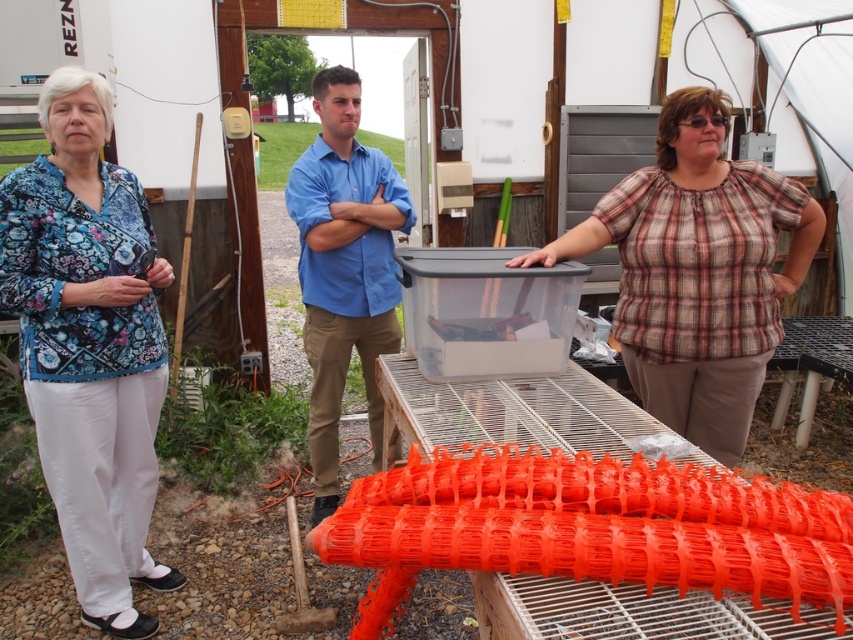
You are a farmer who needs to decide which shirt to wear based on the image. The plaid cotton shirt at center and the blue cotton shirt at center are both available. Which shirt is located to the right of the other?

The plaid cotton shirt at center is positioned on the right side of blue cotton shirt at center.

You are standing in the scene and see the point at coordinates (90, 346). What object is this point located on?

The point at (90, 346) is located on the floral fabric blouse at left.

You are standing at the point labeled as point (x=680, y=132) and want to walk to the point labeled as point (x=68, y=454). Which direction should you move relative to your current position?

You should move forward because point (x=68, y=454) is in front of point (x=680, y=132).